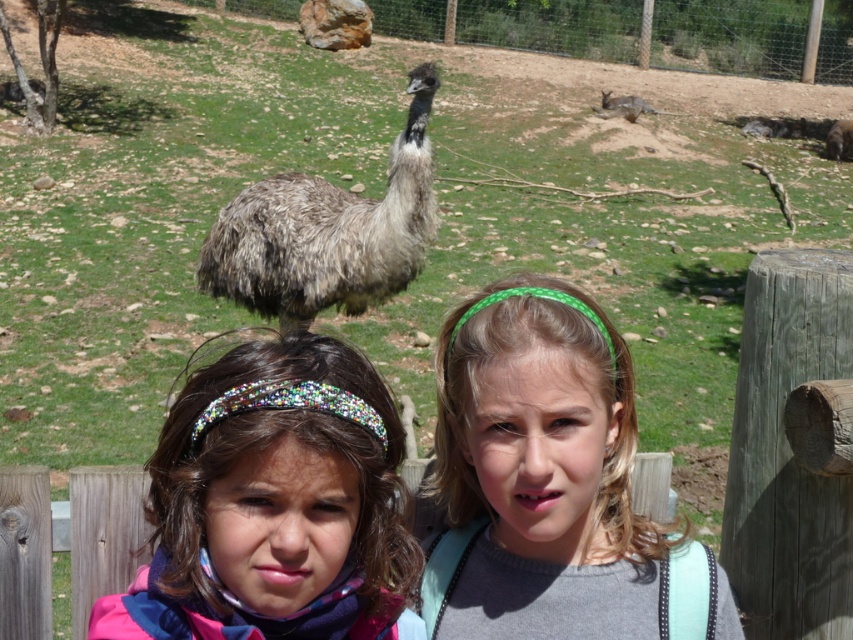
Is matte gray shirt at center wider than fuzzy gray kangaroo at upper right?

No, matte gray shirt at center is not wider than fuzzy gray kangaroo at upper right.

Is point (520, 538) behind point (757, 125)?

No, (520, 538) is closer to viewer.

Measure the distance between matte gray shirt at center and camera.

1.54 meters

The width and height of the screenshot is (853, 640). What are the coordinates of `matte gray shirt at center` in the screenshot? It's located at (541, 474).

Can you confirm if brown fuzzy ostrich at center is positioned to the left of wooden fence at lower center?

Incorrect, brown fuzzy ostrich at center is not on the left side of wooden fence at lower center.

Who is positioned more to the left, brown fuzzy ostrich at center or wooden fence at lower center?

From the viewer's perspective, wooden fence at lower center appears more on the left side.

Is point (358, 218) farther from camera compared to point (413, 477)?

Yes, it is behind point (413, 477).

You are a GUI agent. You are given a task and a screenshot of the screen. Output one action in this format:
    pyautogui.click(x=<x>, y=<y>)
    Task: Click on the brown fuzzy ostrich at center
    This screenshot has height=640, width=853.
    Given the screenshot: What is the action you would take?
    pyautogui.click(x=328, y=232)

Is multicolored sequined headband at center to the left of fuzzy brown animal at center from the viewer's perspective?

Correct, you'll find multicolored sequined headband at center to the left of fuzzy brown animal at center.

Does multicolored sequined headband at center have a smaller size compared to fuzzy brown animal at center?

Yes.

Between point (260, 422) and point (849, 150), which one is positioned behind?

The point (849, 150) is behind.

Locate an element on the screen. This screenshot has height=640, width=853. multicolored sequined headband at center is located at coordinates (273, 502).